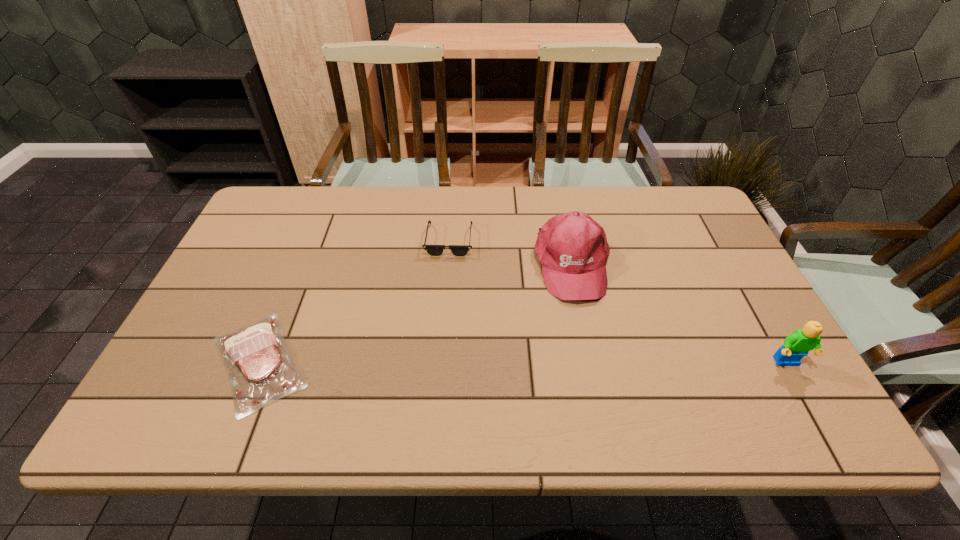
Find the location of a particular element. The height and width of the screenshot is (540, 960). free space that is in between the baseball cap and the shortest object is located at coordinates (416, 313).

At what (x,y) coordinates should I click in order to perform the action: click on unoccupied area between the sunglasses and the shortest object. Please return your answer as a coordinate pair (x, y). The width and height of the screenshot is (960, 540). Looking at the image, I should click on (354, 301).

Where is `vacant area between the shortest object and the rightmost object`? The height and width of the screenshot is (540, 960). vacant area between the shortest object and the rightmost object is located at coordinates (523, 362).

Identify the location of vacant point located between the Lego and the second shortest object. (618, 301).

Locate an element on the screen. vacant space that is in between the Lego and the steak is located at coordinates (523, 362).

Find the location of a particular element. free space between the rightmost object and the shortest object is located at coordinates (523, 362).

Find the location of a particular element. vacant area between the rightmost object and the shortest object is located at coordinates (523, 362).

Identify which object is located as the third nearest to the third object from left to right. Please provide its 2D coordinates. Your answer should be formatted as a tuple, i.e. [(x, y)], where the tuple contains the x and y coordinates of a point satisfying the conditions above.

[(261, 370)]

You are a GUI agent. You are given a task and a screenshot of the screen. Output one action in this format:
    pyautogui.click(x=<x>, y=<y>)
    Task: Click on the object that ranks as the second closest to the third object from right to left
    
    Given the screenshot: What is the action you would take?
    pyautogui.click(x=261, y=370)

Locate an element on the screen. vacant space that satisfies the following two spatial constraints: 1. on the back side of the steak; 2. on the right side of the second object from left to right is located at coordinates (309, 240).